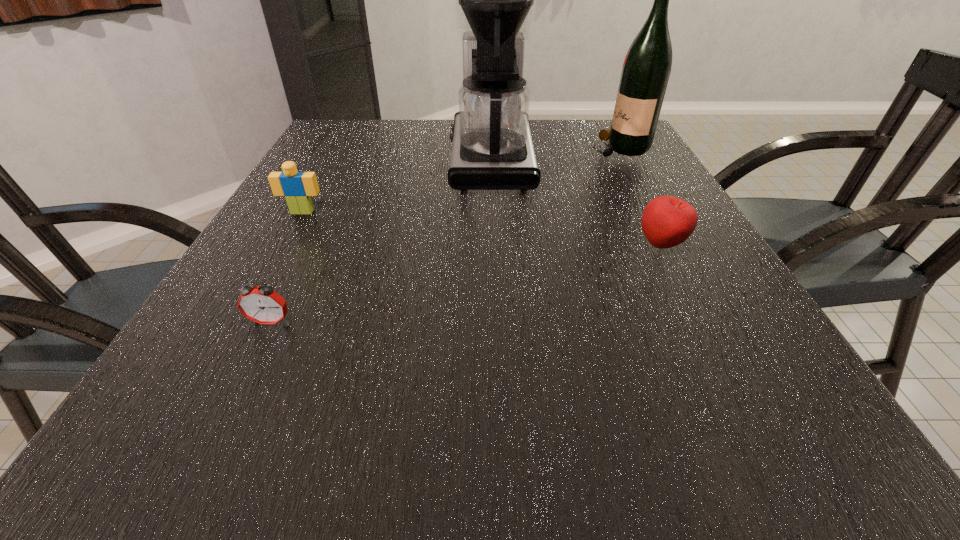
Where is `free space at the far edge`? This screenshot has width=960, height=540. free space at the far edge is located at coordinates (541, 129).

This screenshot has height=540, width=960. What are the coordinates of `vacant space at the near edge` in the screenshot? It's located at (362, 415).

Identify the location of vacant region at the left edge. The image size is (960, 540). (319, 211).

What are the coordinates of `free spot at the right edge of the desktop` in the screenshot? It's located at (643, 184).

In the image, there is a desktop. What are the coordinates of `vacant area at the far left corner` in the screenshot? It's located at (330, 126).

At what (x,y) coordinates should I click in order to perform the action: click on vacant area at the near left corner of the desktop. Please return your answer as a coordinate pair (x, y). This screenshot has height=540, width=960. Looking at the image, I should click on (223, 414).

At what (x,y) coordinates should I click in order to perform the action: click on vacant area between the fourth farthest object and the Lego. Please return your answer as a coordinate pair (x, y). Looking at the image, I should click on (482, 228).

Image resolution: width=960 pixels, height=540 pixels. I want to click on free spot between the wine bottle and the nearest object, so click(444, 234).

Locate an element on the screen. The image size is (960, 540). free space between the third farthest object and the coffee maker is located at coordinates click(x=396, y=186).

Find the location of a particular element. free point between the wine bottle and the fourth farthest object is located at coordinates (640, 196).